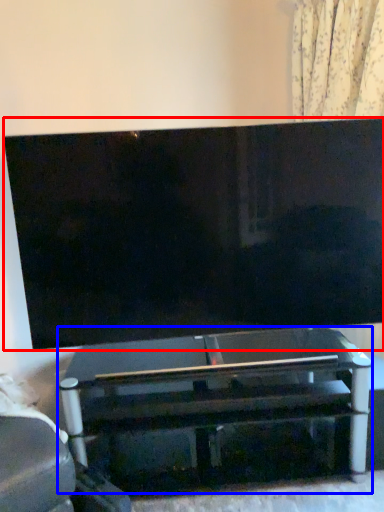
Question: Which object appears farthest to the camera in this image, television (highlighted by a red box) or table (highlighted by a blue box)?

Choices:
 (A) television
 (B) table

Answer: (B)